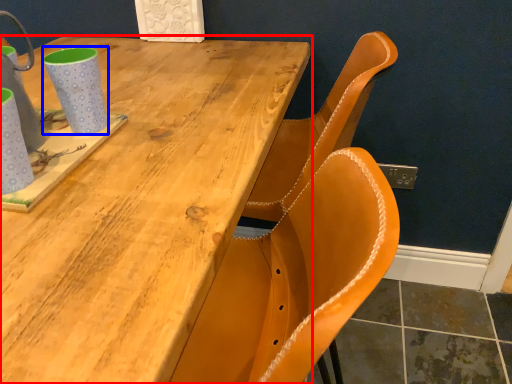
Question: Which point is further to the camera, table (highlighted by a red box) or mug (highlighted by a blue box)?

Choices:
 (A) table
 (B) mug

Answer: (B)